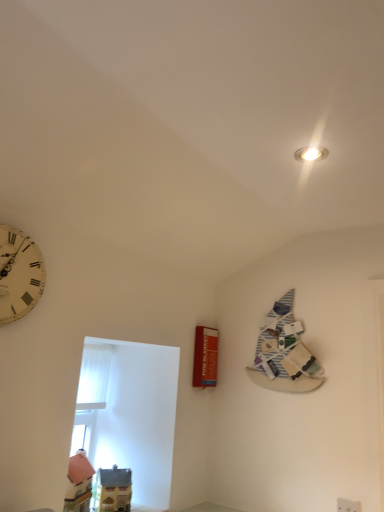
The width and height of the screenshot is (384, 512). What do you see at coordinates (205, 357) in the screenshot?
I see `red matte fire blanket at center-right` at bounding box center [205, 357].

Find the location of a particular element. Image resolution: width=384 pixels, height=512 pixels. striped paper book at upper right is located at coordinates (284, 352).

What's the angular difference between white plastic electric outlet at lower right and striped paper book at upper right's facing directions?

The facing directions of white plastic electric outlet at lower right and striped paper book at upper right are 0.42 degrees apart.

Is white plastic electric outlet at lower right taller or shorter than striped paper book at upper right?

In the image, white plastic electric outlet at lower right appears to be shorter than striped paper book at upper right.

Does point (358, 502) appear closer or farther from the camera than point (303, 328)?

Clearly, point (358, 502) is closer to the camera than point (303, 328).

Who is smaller, striped paper book at upper right or red matte fire blanket at center-right?

red matte fire blanket at center-right.

Is striped paper book at upper right thinner than red matte fire blanket at center-right?

Yes, striped paper book at upper right is thinner than red matte fire blanket at center-right.

Could you tell me if striped paper book at upper right is turned towards red matte fire blanket at center-right?

No, striped paper book at upper right is not aimed at red matte fire blanket at center-right.

Which object is positioned more to the right, striped paper book at upper right or red matte fire blanket at center-right?

Positioned to the right is striped paper book at upper right.

From the image's perspective, between red matte fire blanket at center-right and white plastic electric outlet at lower right, who is located below?

white plastic electric outlet at lower right.

Based on their positions, is red matte fire blanket at center-right located to the left or right of white plastic electric outlet at lower right?

red matte fire blanket at center-right is positioned on white plastic electric outlet at lower right's left side.

Considering the sizes of objects red matte fire blanket at center-right and white plastic electric outlet at lower right in the image provided, who is taller, red matte fire blanket at center-right or white plastic electric outlet at lower right?

With more height is red matte fire blanket at center-right.

Between point (286, 317) and point (43, 273), which one is positioned behind?

The point (286, 317) is behind.

Is the position of striped paper book at upper right less distant than that of white vintage clock at left?

No, striped paper book at upper right is behind white vintage clock at left.

Is there a large distance between striped paper book at upper right and white vintage clock at left?

That's right, there is a large distance between striped paper book at upper right and white vintage clock at left.

Which point is more forward, (342, 509) or (210, 332)?

The point (342, 509) is closer to the camera.

Based on the photo, considering the relative positions of white plastic electric outlet at lower right and red matte fire blanket at center-right in the image provided, is white plastic electric outlet at lower right to the left of red matte fire blanket at center-right from the viewer's perspective?

Incorrect, white plastic electric outlet at lower right is not on the left side of red matte fire blanket at center-right.

From the image's perspective, is white plastic electric outlet at lower right located beneath red matte fire blanket at center-right?

Correct, white plastic electric outlet at lower right appears lower than red matte fire blanket at center-right in the image.

Consider the image. In terms of height, does white plastic electric outlet at lower right look taller or shorter compared to red matte fire blanket at center-right?

Considering their sizes, white plastic electric outlet at lower right has less height than red matte fire blanket at center-right.

Does red matte fire blanket at center-right have a lesser width compared to white vintage clock at left?

In fact, red matte fire blanket at center-right might be wider than white vintage clock at left.

Is point (214, 357) less distant than point (22, 273)?

No, it is not.

From the image's perspective, does red matte fire blanket at center-right appear lower than white vintage clock at left?

Yes, from the image's perspective, red matte fire blanket at center-right is beneath white vintage clock at left.

Are striped paper book at upper right and white plastic electric outlet at lower right located far from each other?

No, there isn't a large distance between striped paper book at upper right and white plastic electric outlet at lower right.

Could you measure the distance between striped paper book at upper right and white plastic electric outlet at lower right?

striped paper book at upper right and white plastic electric outlet at lower right are 24.53 inches apart.

Is striped paper book at upper right oriented towards white plastic electric outlet at lower right?

No, striped paper book at upper right is not turned towards white plastic electric outlet at lower right.

Is striped paper book at upper right positioned before white plastic electric outlet at lower right?

No, the depth of striped paper book at upper right is greater than that of white plastic electric outlet at lower right.

Locate an element on the screen. book above the white plastic electric outlet at lower right (from a real-world perspective) is located at coordinates (284, 352).

Find the location of a particular element. Image resolution: width=384 pixels, height=512 pixels. book on the right of red matte fire blanket at center-right is located at coordinates (284, 352).

Which object lies nearer to the anchor point striped paper book at upper right, white vintage clock at left or red matte fire blanket at center-right?

red matte fire blanket at center-right.

Considering their positions, is striped paper book at upper right positioned closer to white plastic electric outlet at lower right than white vintage clock at left?

The object closer to white plastic electric outlet at lower right is striped paper book at upper right.

Considering their positions, is red matte fire blanket at center-right positioned closer to white plastic electric outlet at lower right than striped paper book at upper right?

striped paper book at upper right is closer to white plastic electric outlet at lower right.

Looking at the image, which one is located closer to striped paper book at upper right, white vintage clock at left or white plastic electric outlet at lower right?

Among the two, white plastic electric outlet at lower right is located nearer to striped paper book at upper right.

From the image, which object appears to be nearer to red matte fire blanket at center-right, white plastic electric outlet at lower right or striped paper book at upper right?

Among the two, striped paper book at upper right is located nearer to red matte fire blanket at center-right.

From the image, which object appears to be nearer to striped paper book at upper right, red matte fire blanket at center-right or white plastic electric outlet at lower right?

red matte fire blanket at center-right lies closer to striped paper book at upper right than the other object.

When comparing their distances from white plastic electric outlet at lower right, does striped paper book at upper right or red matte fire blanket at center-right seem closer?

striped paper book at upper right is positioned closer to the anchor white plastic electric outlet at lower right.

Which object lies nearer to the anchor point red matte fire blanket at center-right, white vintage clock at left or striped paper book at upper right?

striped paper book at upper right is closer to red matte fire blanket at center-right.

At what (x,y) coordinates should I click in order to perform the action: click on book located between white vintage clock at left and white plastic electric outlet at lower right in the left-right direction. Please return your answer as a coordinate pair (x, y). The height and width of the screenshot is (512, 384). Looking at the image, I should click on (284, 352).

Locate an element on the screen. This screenshot has height=512, width=384. magazine between white vintage clock at left and striped paper book at upper right from left to right is located at coordinates (205, 357).

At what (x,y) coordinates should I click in order to perform the action: click on magazine situated between white vintage clock at left and white plastic electric outlet at lower right from left to right. Please return your answer as a coordinate pair (x, y). Looking at the image, I should click on (205, 357).

Where is `magazine between striped paper book at upper right and white plastic electric outlet at lower right from top to bottom`? The height and width of the screenshot is (512, 384). magazine between striped paper book at upper right and white plastic electric outlet at lower right from top to bottom is located at coordinates coord(205,357).